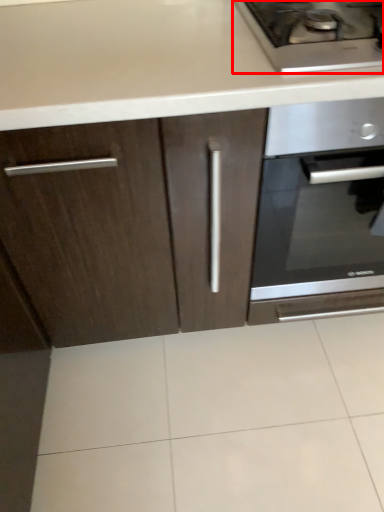
Question: From the image's perspective, what is the correct spatial positioning of gas stove (annotated by the red box) in reference to oven?

Choices:
 (A) below
 (B) above

Answer: (B)